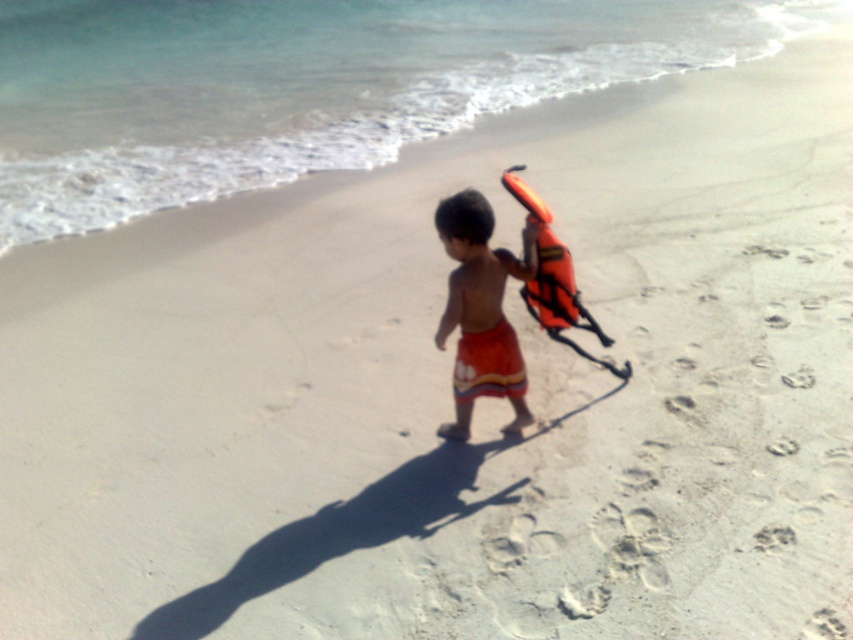
Question: Can you confirm if orange fabric life vest at center is positioned to the left of orange fabric life jacket at right?

Choices:
 (A) no
 (B) yes

Answer: (B)

Question: Can you confirm if orange fabric life vest at center is positioned to the left of orange fabric life jacket at right?

Choices:
 (A) no
 (B) yes

Answer: (B)

Question: Is orange fabric life vest at center wider than orange fabric shorts at center?

Choices:
 (A) no
 (B) yes

Answer: (B)

Question: Estimate the real-world distances between objects in this image. Which object is farther from the orange fabric life jacket at right?

Choices:
 (A) orange fabric life vest at center
 (B) orange fabric shorts at center

Answer: (B)

Question: Which of these objects is positioned closest to the orange fabric life jacket at right?

Choices:
 (A) orange fabric life vest at center
 (B) orange fabric shorts at center

Answer: (A)

Question: Which of the following is the farthest from the observer?

Choices:
 (A) orange fabric life vest at center
 (B) orange fabric life jacket at right

Answer: (B)